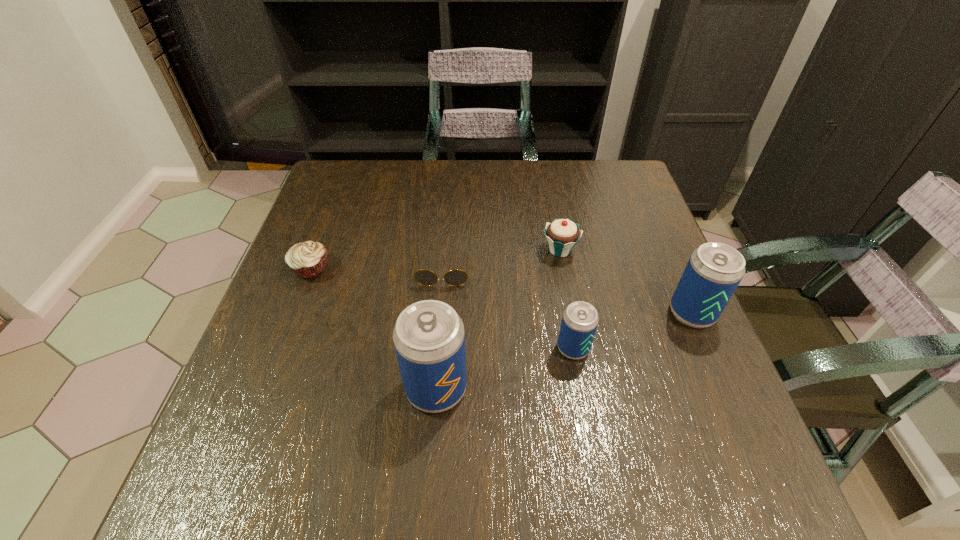
Locate an element on the screen. The height and width of the screenshot is (540, 960). vacant space located 0.250m on the left of the leftmost beer can is located at coordinates (270, 388).

Identify the location of vacant space located on the back of the second nearest object. The width and height of the screenshot is (960, 540). (564, 301).

Locate an element on the screen. Image resolution: width=960 pixels, height=540 pixels. vacant space positioned 0.200m on the back of the rightmost object is located at coordinates (660, 237).

The height and width of the screenshot is (540, 960). Identify the location of free point located on the back of the cupcake. (549, 192).

Where is `vacant space located on the lenses of the shortest object`? The height and width of the screenshot is (540, 960). vacant space located on the lenses of the shortest object is located at coordinates (429, 440).

At what (x,y) coordinates should I click in order to perform the action: click on vacant position located 0.330m on the front of the leftmost object. Please return your answer as a coordinate pair (x, y). Image resolution: width=960 pixels, height=540 pixels. Looking at the image, I should click on (253, 420).

You are a GUI agent. You are given a task and a screenshot of the screen. Output one action in this format:
    pyautogui.click(x=<x>, y=<y>)
    Task: Click on the object that is at the near edge
    Image resolution: width=960 pixels, height=540 pixels.
    Given the screenshot: What is the action you would take?
    pyautogui.click(x=429, y=338)

Identify the location of object positioned at the left edge. The image size is (960, 540). (308, 259).

Identify the location of object that is at the right edge. The width and height of the screenshot is (960, 540). (714, 270).

Locate an element on the screen. The height and width of the screenshot is (540, 960). vacant space at the far edge of the desktop is located at coordinates (528, 187).